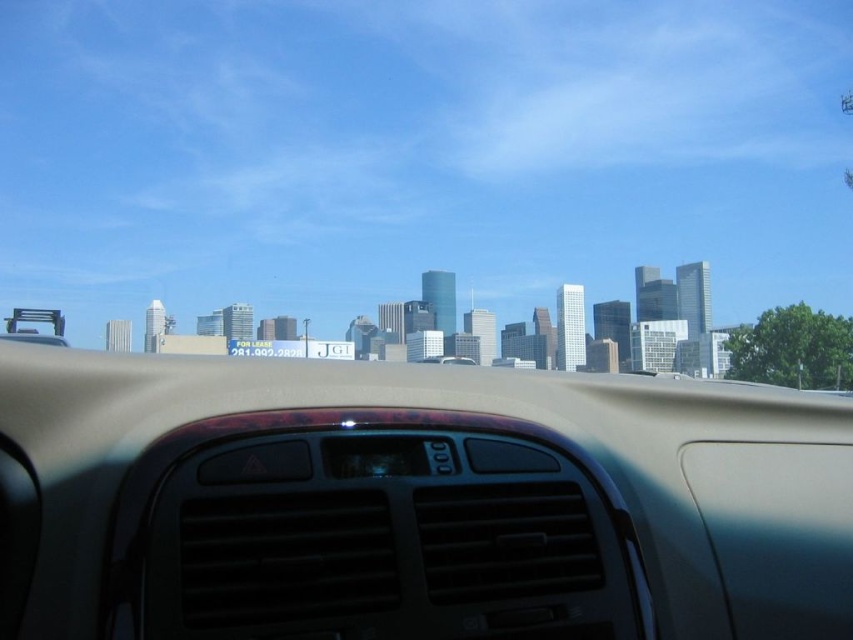
Question: Which object is closer to the camera taking this photo?

Choices:
 (A) transparent plastic air vent at center
 (B) beige matte dashboard at center

Answer: (B)

Question: Which point is closer to the camera?

Choices:
 (A) (523, 556)
 (B) (216, 618)

Answer: (B)

Question: Does beige matte dashboard at center appear over transparent plastic air vent at center?

Choices:
 (A) yes
 (B) no

Answer: (A)

Question: Which point is closer to the camera?

Choices:
 (A) beige matte dashboard at center
 (B) transparent plastic air vent at center

Answer: (A)

Question: Does beige matte dashboard at center have a lesser width compared to transparent plastic air vent at center?

Choices:
 (A) no
 (B) yes

Answer: (A)

Question: From the image, what is the correct spatial relationship of beige matte dashboard at center in relation to transparent plastic air vent at center?

Choices:
 (A) below
 (B) above

Answer: (B)